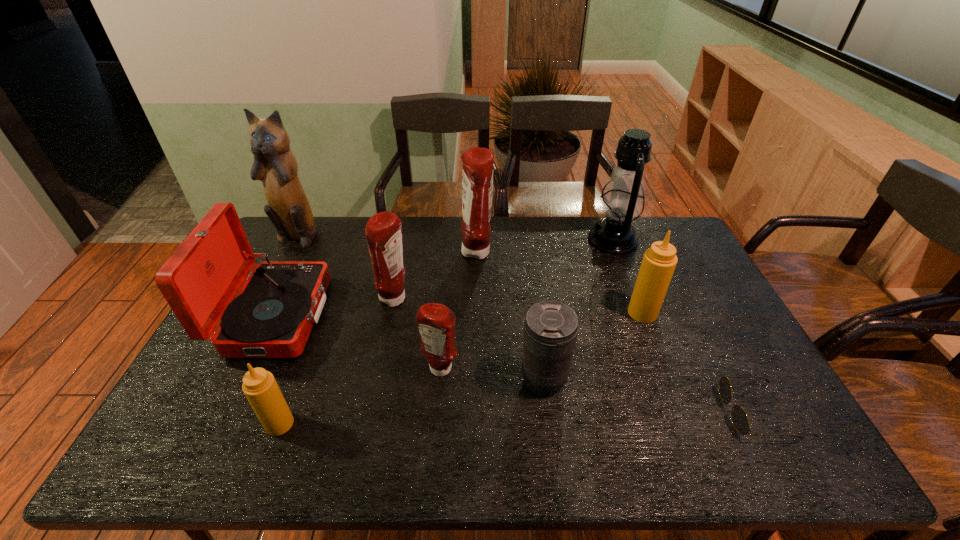
In order to click on vacant space that satisfies the following two spatial constraints: 1. on the front-facing side of the left tan condiment; 2. on the left side of the phonograph_record in this screenshot , I will do `click(225, 424)`.

I want to click on free region that satisfies the following two spatial constraints: 1. on the front side of the leftmost red condiment; 2. on the front-facing side of the phonograph_record, so click(392, 316).

The image size is (960, 540). I want to click on vacant space that satisfies the following two spatial constraints: 1. on the face of the farther tan condiment; 2. on the left side of the cat, so click(255, 313).